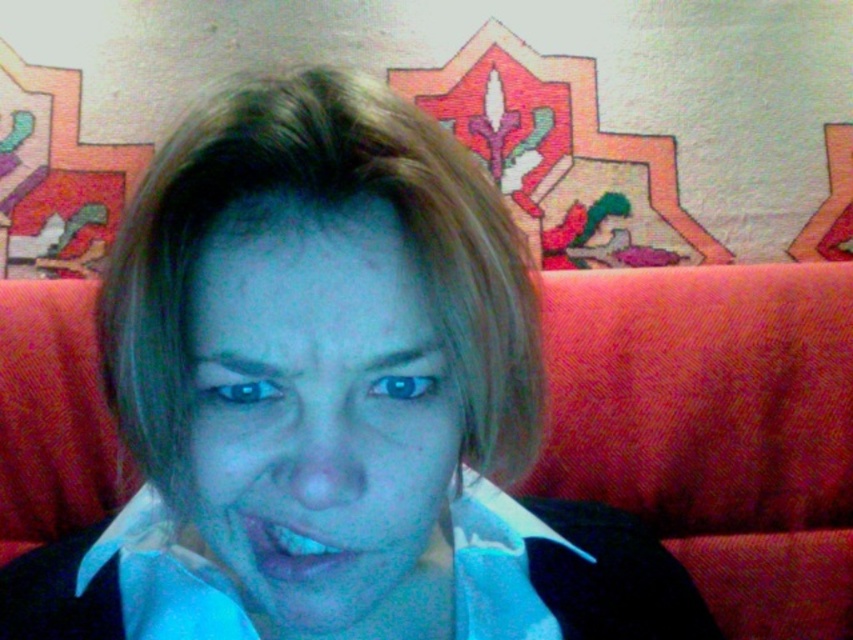
You are a photographer adjusting your camera to focus on two points in the image. The first point is at coordinates point (438, 509) and the second is at point (323, 561). If you want to capture both points clearly in a single shot, which point should you focus on first to ensure depth of field covers both?

Point (438, 509) is behind point (323, 561), so you should focus on the closer point (323, 561) first to ensure depth of field covers both points.

You are a makeup artist observing the blue matte face at center and the blue glossy lips at center. Which one is closer to the camera?

The blue matte face at center is closer to the camera than the blue glossy lips at center.

You are a makeup artist analyzing the image of a person with short light brown hair. You need to determine the placement of a new lip product sample. The sample requires a space that is smaller than the area it will be placed on. Based on the provided image, can the blue glossy lips at center be placed on the blue matte face at center appropriately?

The blue matte face at center has a larger size compared to blue glossy lips at center. Since the required space for the lips is smaller than the face area, the blue glossy lips at center can be appropriately placed on the blue matte face at center.